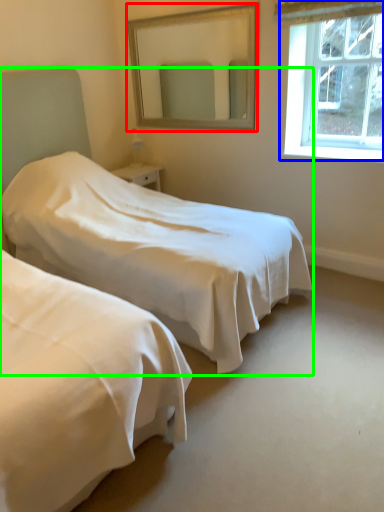
Question: Which is nearer to the mirror (highlighted by a red box)? window (highlighted by a blue box) or bed (highlighted by a green box).

Choices:
 (A) window
 (B) bed

Answer: (A)